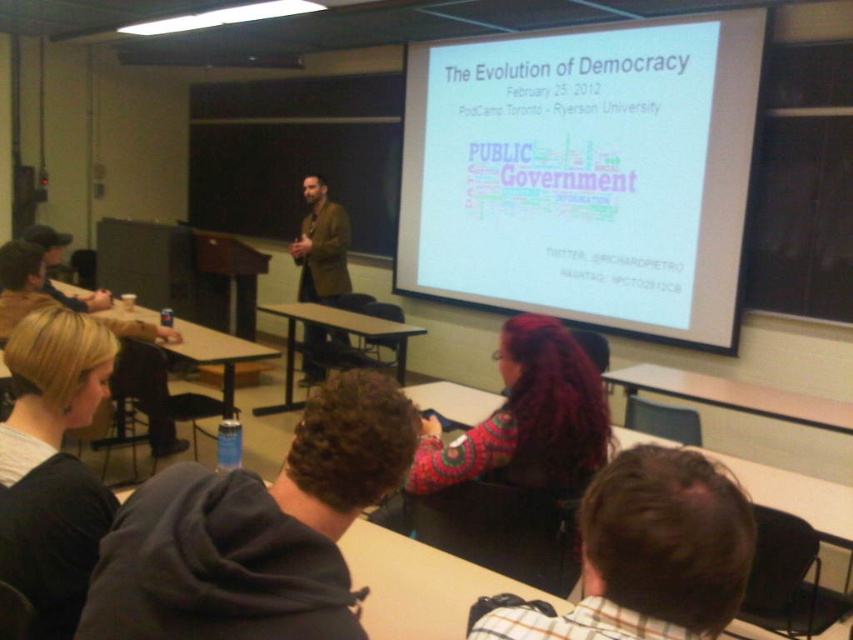
I want to click on white matte projection screen at upper center, so click(x=585, y=173).

Which is in front, point (709, 198) or point (96, 502)?

Point (96, 502) is more forward.

Identify the location of white matte projection screen at upper center. The width and height of the screenshot is (853, 640). (585, 173).

Who is more forward, (x=450, y=240) or (x=323, y=205)?

Point (x=323, y=205) is in front.

Does white matte projection screen at upper center have a larger size compared to brown leather jacket at center?

Result: Correct, white matte projection screen at upper center is larger in size than brown leather jacket at center.

The width and height of the screenshot is (853, 640). I want to click on white matte projection screen at upper center, so click(585, 173).

Can you confirm if blonde hair at lower left is positioned to the left of multicolored knitted sweater at center?

Yes, blonde hair at lower left is to the left of multicolored knitted sweater at center.

Measure the distance between point (83, 422) and camera.

They are 5.15 feet apart.

Does point (80, 368) come farther from viewer compared to point (582, 435)?

No, (80, 368) is in front of (582, 435).

In order to click on blonde hair at lower left in this screenshot , I will do `click(51, 465)`.